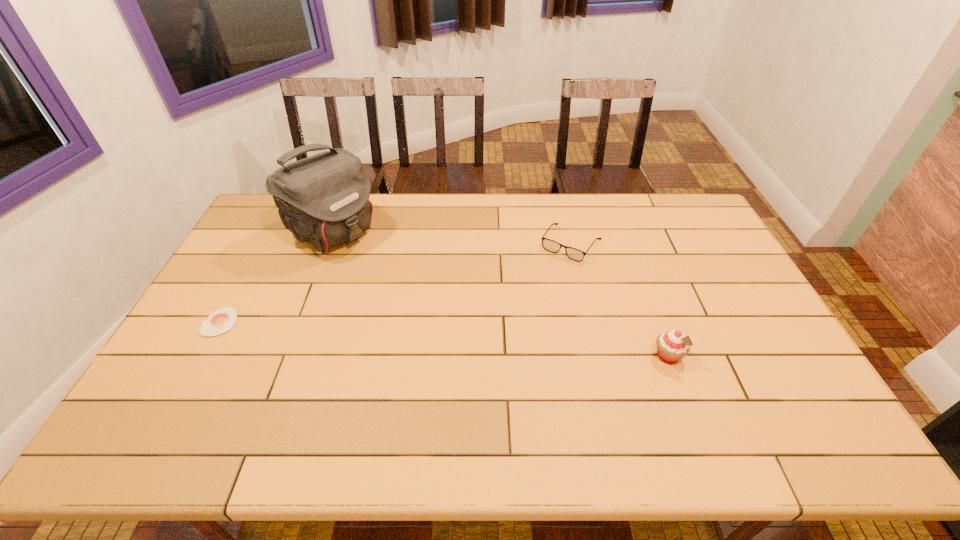
Find the location of a particular element. Image resolution: width=960 pixels, height=540 pixels. free space between the third tallest object and the third farthest object is located at coordinates (396, 283).

This screenshot has height=540, width=960. What are the coordinates of `free space between the tallest object and the second object from right to left` in the screenshot? It's located at (x=452, y=238).

The width and height of the screenshot is (960, 540). Identify the location of unoccupied position between the shortest object and the shoulder bag. (276, 277).

Image resolution: width=960 pixels, height=540 pixels. Find the location of `free space between the second object from right to left and the tallest object`. free space between the second object from right to left and the tallest object is located at coordinates (452, 238).

Where is `object that is the second closest one to the second shortest object`? The image size is (960, 540). object that is the second closest one to the second shortest object is located at coordinates (323, 199).

Locate an element on the screen. The width and height of the screenshot is (960, 540). the second closest object to the spectacles is located at coordinates (323, 199).

Identify the location of vacant region that satisfies the following two spatial constraints: 1. on the back side of the egg yolk; 2. on the left side of the tallest object. The image size is (960, 540). point(270,232).

Where is `vacant position in the image that satisfies the following two spatial constraints: 1. on the front side of the nearest object; 2. on the left side of the shoulder bag`? The height and width of the screenshot is (540, 960). vacant position in the image that satisfies the following two spatial constraints: 1. on the front side of the nearest object; 2. on the left side of the shoulder bag is located at coordinates (286, 356).

Image resolution: width=960 pixels, height=540 pixels. Find the location of `vacant space that satisfies the following two spatial constraints: 1. on the front side of the spectacles; 2. on the right side of the nearest object`. vacant space that satisfies the following two spatial constraints: 1. on the front side of the spectacles; 2. on the right side of the nearest object is located at coordinates (597, 356).